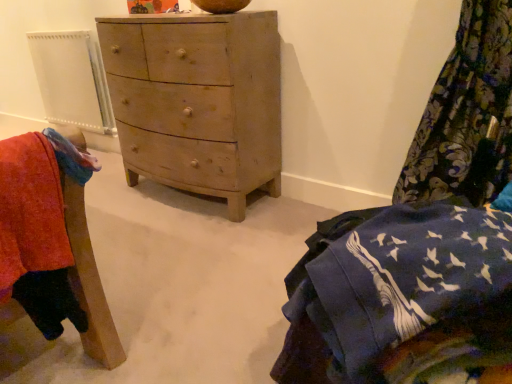
Question: Choose the correct answer: Is wooden chest of drawers at center inside wooden chair at lower left or outside it?

Choices:
 (A) inside
 (B) outside

Answer: (B)

Question: From a real-world perspective, relative to wooden chair at lower left, is wooden chest of drawers at center vertically above or below?

Choices:
 (A) below
 (B) above

Answer: (A)

Question: Estimate the real-world distances between objects in this image. Which object is farther from the wooden chest of drawers at center?

Choices:
 (A) blue cotton blanket at lower right
 (B) wooden chair at lower left
 (C) floral fabric curtain at right
 (D) white plastic radiator at left

Answer: (A)

Question: Which is farther from the blue cotton blanket at lower right?

Choices:
 (A) wooden chair at lower left
 (B) floral fabric curtain at right
 (C) white plastic radiator at left
 (D) wooden chest of drawers at center

Answer: (C)